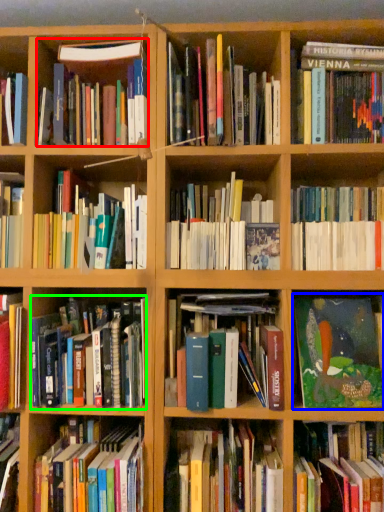
Question: Based on their relative distances, which object is farther from book (highlighted by a red box)? Choose from book (highlighted by a blue box) and book (highlighted by a green box).

Choices:
 (A) book
 (B) book

Answer: (A)